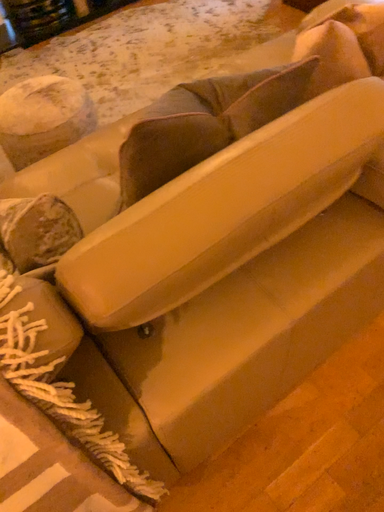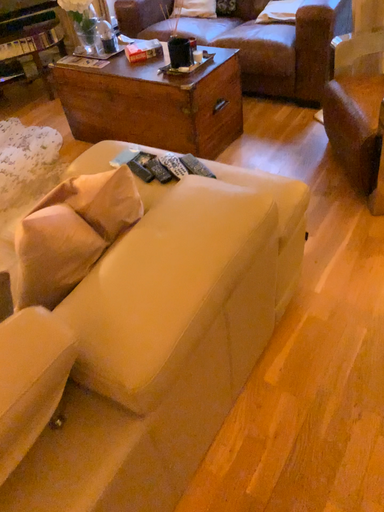
Question: How did the camera likely rotate when shooting the video?

Choices:
 (A) rotated right
 (B) rotated left

Answer: (A)